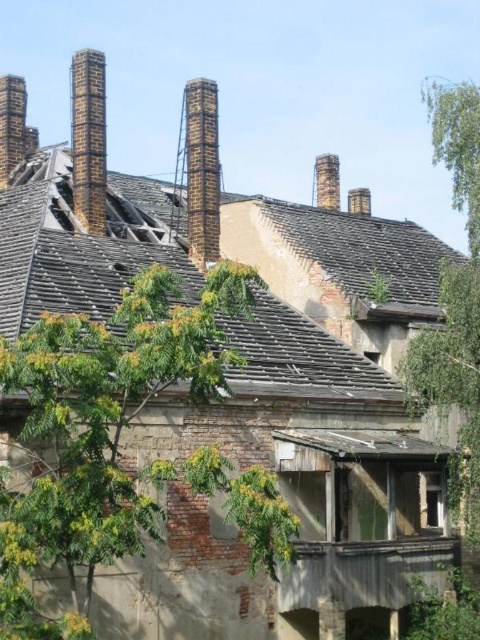
Is green leafy tree at upper right to the left of brick chimney at upper left from the viewer's perspective?

Incorrect, green leafy tree at upper right is not on the left side of brick chimney at upper left.

Between green leafy tree at upper right and brick chimney at upper left, which one has less height?

Standing shorter between the two is brick chimney at upper left.

Does point (474, 170) come behind point (0, 77)?

No, (474, 170) is in front of (0, 77).

Where is `green leafy tree at upper right`? green leafy tree at upper right is located at coordinates (455, 300).

Is green leafy tree at center in front of green leafy tree at upper right?

Yes, green leafy tree at center is in front of green leafy tree at upper right.

Which of these two, green leafy tree at center or green leafy tree at upper right, stands taller?

green leafy tree at upper right

In order to click on green leafy tree at center in this screenshot , I will do [x=108, y=412].

Can you confirm if rusty metal chimney at center is positioned above brick chimney at upper left?

No.

Which is behind, point (210, 250) or point (13, 170)?

The point (13, 170) is more distant.

Who is more forward, (x=191, y=220) or (x=11, y=76)?

Point (x=191, y=220)

Identify the location of rusty metal chimney at center. (202, 170).